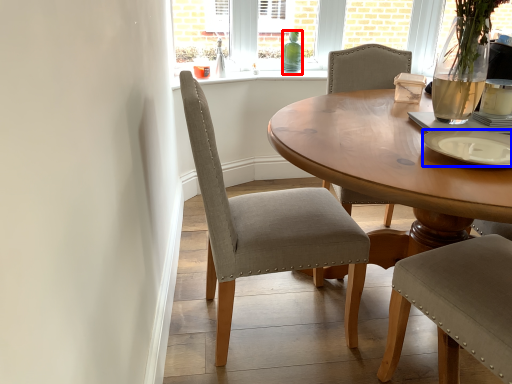
Question: Which point is closer to the camera, bottle (highlighted by a red box) or plate (highlighted by a blue box)?

Choices:
 (A) bottle
 (B) plate

Answer: (B)